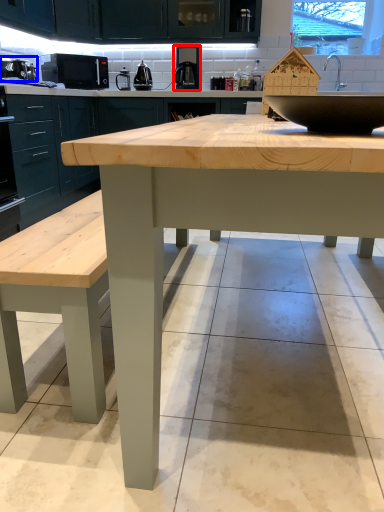
Question: Which object appears closest to the camera in this image, coffee machine (highlighted by a red box) or appliance (highlighted by a blue box)?

Choices:
 (A) coffee machine
 (B) appliance

Answer: (B)